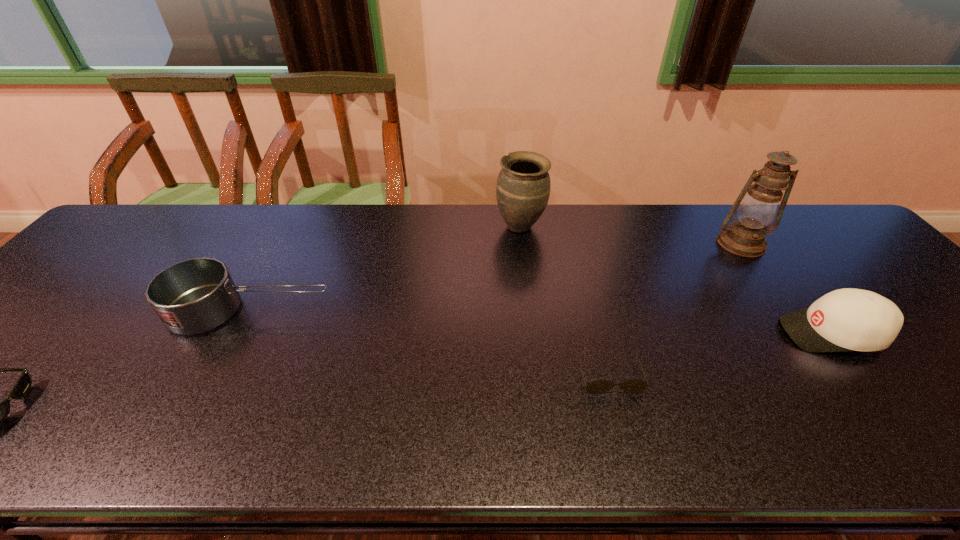
Image resolution: width=960 pixels, height=540 pixels. In order to click on vacant space positioned on the front-facing side of the baseball cap in this screenshot , I will do `click(685, 333)`.

Find the location of `vacant area located with the handle extending from one side of the fifth object from right to left`. vacant area located with the handle extending from one side of the fifth object from right to left is located at coordinates (377, 310).

The image size is (960, 540). I want to click on vacant space situated on the front-facing side of the third object from right to left, so click(625, 435).

This screenshot has height=540, width=960. Identify the location of oil lamp that is at the far edge. (745, 237).

Find the location of a particular element. Image resolution: width=960 pixels, height=540 pixels. urn located in the far edge section of the desktop is located at coordinates (523, 185).

The image size is (960, 540). I want to click on vacant space at the far edge of the desktop, so click(276, 207).

The width and height of the screenshot is (960, 540). Identify the location of blank space at the near edge. (699, 435).

Image resolution: width=960 pixels, height=540 pixels. Find the location of `free space at the left edge`. free space at the left edge is located at coordinates (77, 319).

Image resolution: width=960 pixels, height=540 pixels. Find the location of `blank space at the right edge of the desktop`. blank space at the right edge of the desktop is located at coordinates (850, 253).

In the image, there is a desktop. Where is `vacant space at the far left corner`? The image size is (960, 540). vacant space at the far left corner is located at coordinates (161, 210).